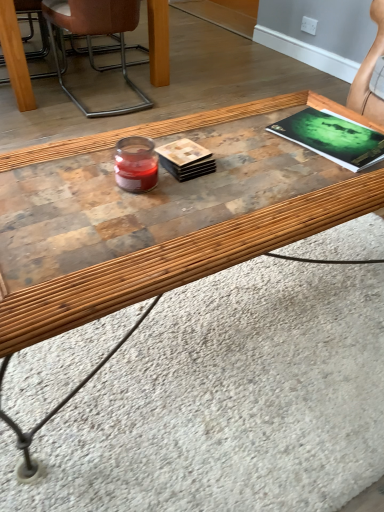
The width and height of the screenshot is (384, 512). Identify the location of vacant space positioned to the left of brown leather chair at upper left. (46, 100).